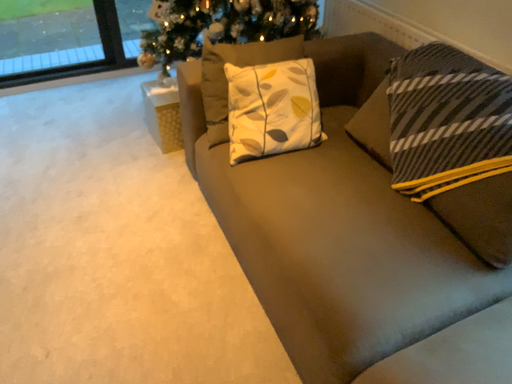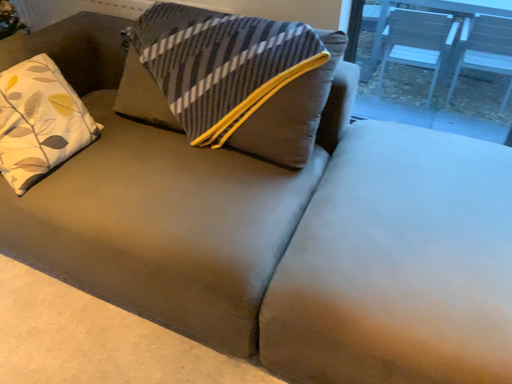
Question: How did the camera likely rotate when shooting the video?

Choices:
 (A) rotated right
 (B) rotated left

Answer: (A)